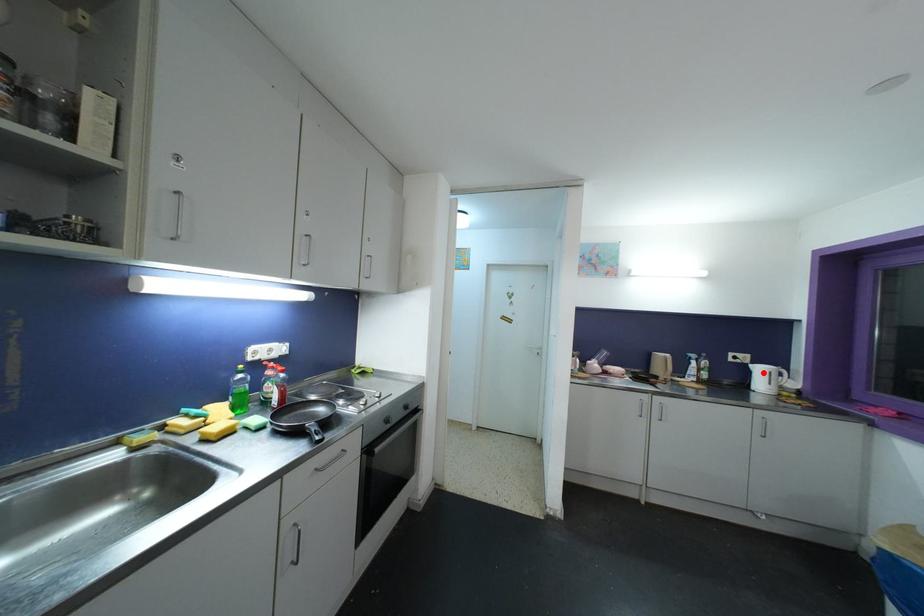
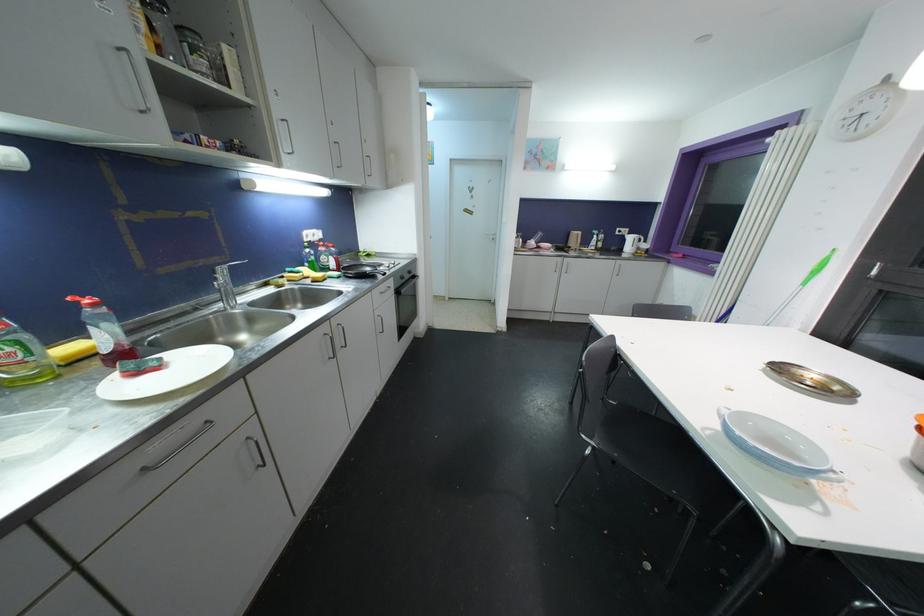
Question: I am providing you with two images of the same scene from different viewpoints. A red point is shown in image1. For the corresponding object point in image2, is it positioned nearer or farther from the camera?

Choices:
 (A) Nearer
 (B) Farther

Answer: (A)